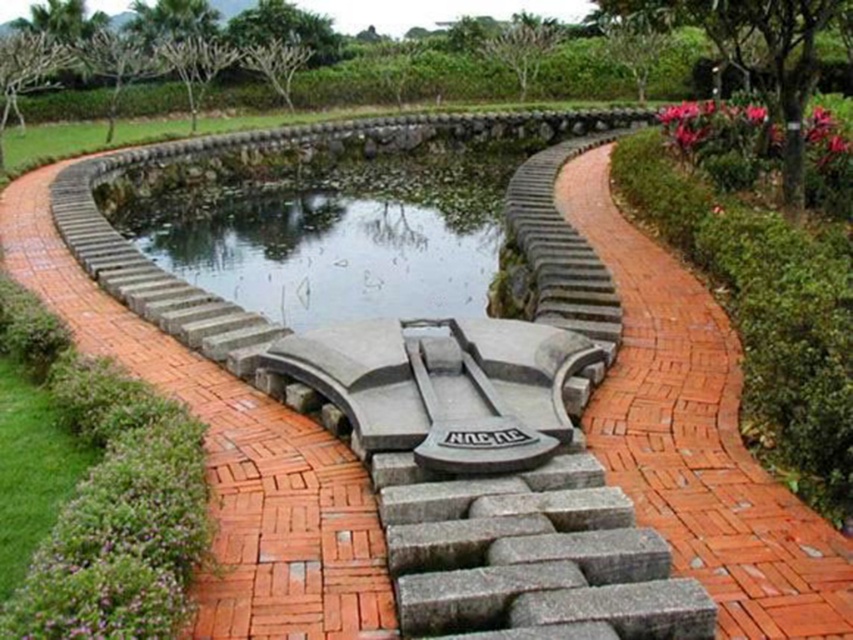
Question: Estimate the real-world distances between objects in this image. Which object is farther from the gray stone bench at center?

Choices:
 (A) clear glass pond at center
 (B) red brick pathway at center

Answer: (A)

Question: From the image, what is the correct spatial relationship of red brick pathway at center in relation to gray stone bench at center?

Choices:
 (A) above
 (B) below

Answer: (A)

Question: Which point is closer to the camera?

Choices:
 (A) clear glass pond at center
 (B) red brick pathway at center
 (C) gray stone bench at center

Answer: (B)

Question: Which of the following is the closest to the observer?

Choices:
 (A) (274, 275)
 (B) (399, 362)

Answer: (B)

Question: Does red brick pathway at center appear on the right side of gray stone bench at center?

Choices:
 (A) yes
 (B) no

Answer: (A)

Question: Can you confirm if clear glass pond at center is positioned above gray stone bench at center?

Choices:
 (A) yes
 (B) no

Answer: (A)